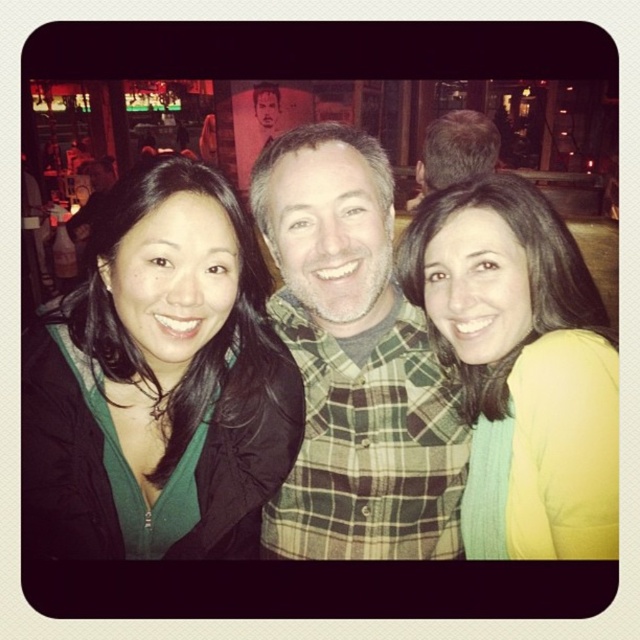
Does green matte jacket at left have a smaller size compared to green plaid shirt at center?

Indeed, green matte jacket at left has a smaller size compared to green plaid shirt at center.

Which of these two, green matte jacket at left or green plaid shirt at center, stands shorter?

With less height is green matte jacket at left.

Identify the location of green matte jacket at left. The height and width of the screenshot is (640, 640). click(x=160, y=381).

Is green plaid shirt at center closer to the viewer compared to yellow matte sweater at center?

No.

Which is more to the right, green plaid shirt at center or yellow matte sweater at center?

yellow matte sweater at center

Is point (426, 497) closer to camera compared to point (429, 276)?

No.

Identify the location of green plaid shirt at center. (353, 362).

Does green matte jacket at left have a greater width compared to yellow matte sweater at center?

Indeed, green matte jacket at left has a greater width compared to yellow matte sweater at center.

Between point (42, 524) and point (618, 451), which one is positioned in front?

Point (618, 451) is more forward.

The width and height of the screenshot is (640, 640). What are the coordinates of `green matte jacket at left` in the screenshot? It's located at (160, 381).